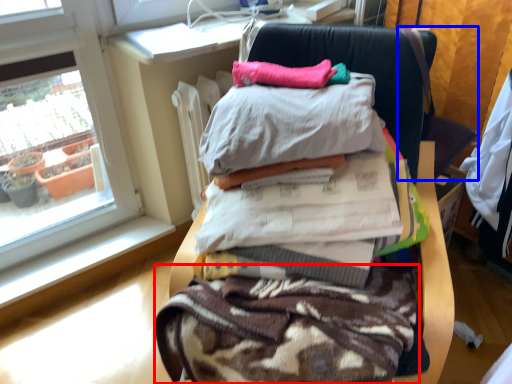
Question: Among these objects, which one is farthest to the camera, fabric (highlighted by a red box) or computer chair (highlighted by a blue box)?

Choices:
 (A) fabric
 (B) computer chair

Answer: (B)